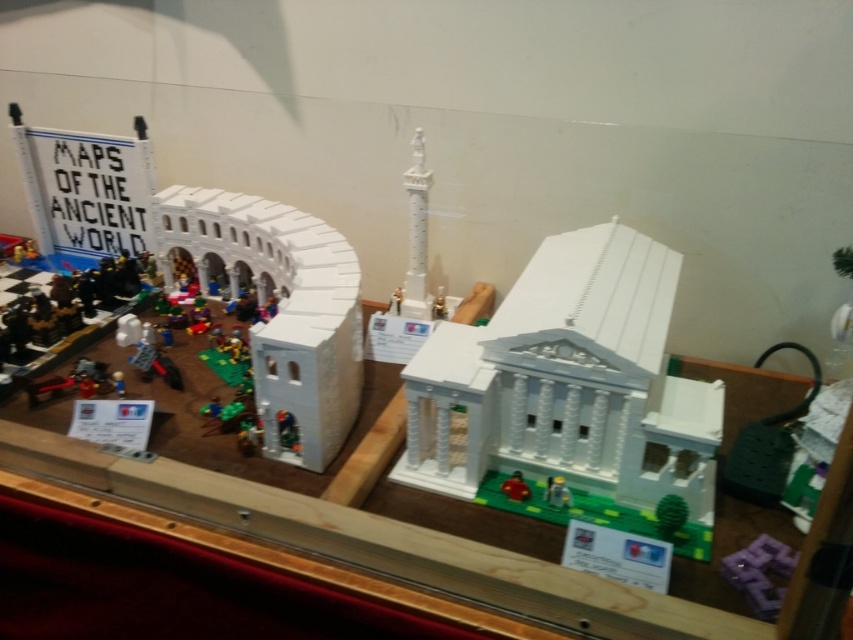
How far apart are white glossy lego building at center and green plastic toy at center?

A distance of 9.39 inches exists between white glossy lego building at center and green plastic toy at center.

Is point (405, 420) more distant than point (567, 500)?

Yes.

Image resolution: width=853 pixels, height=640 pixels. Identify the location of white glossy lego building at center. (572, 387).

Does green plastic toy at center have a lesser width compared to smooth red car at center?

Yes.

Which is in front, point (547, 500) or point (515, 492)?

Point (547, 500) is more forward.

Find the location of a particular element. This screenshot has height=640, width=853. green plastic toy at center is located at coordinates click(556, 492).

Find the location of a particular element. purple plastic blocks at lower right is located at coordinates (759, 573).

Can you confirm if purple plastic blocks at lower right is positioned below green plastic toy at center?

Correct, purple plastic blocks at lower right is located below green plastic toy at center.

Where is `purple plastic blocks at lower right`? The height and width of the screenshot is (640, 853). purple plastic blocks at lower right is located at coordinates (759, 573).

Find the location of `purple plastic blocks at lower right`. purple plastic blocks at lower right is located at coordinates (759, 573).